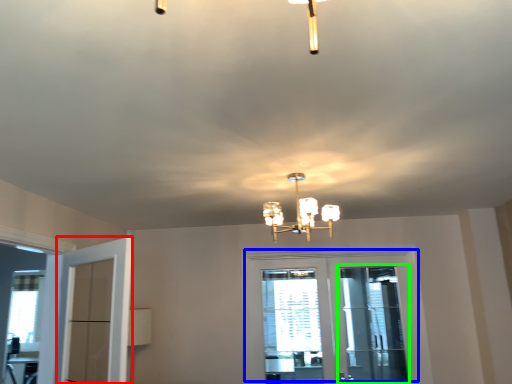
Question: Estimate the real-world distances between objects in this image. Which object is closer to door (highlighted by a red box), door (highlighted by a blue box) or screen door (highlighted by a green box)?

Choices:
 (A) door
 (B) screen door

Answer: (A)